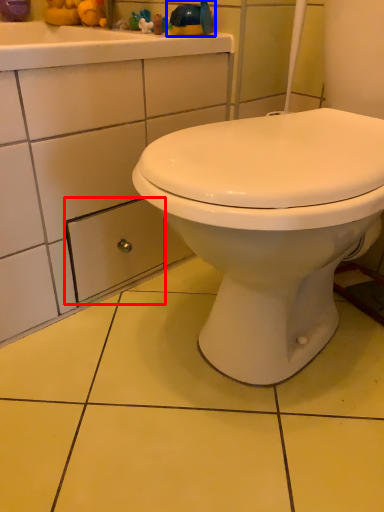
Question: Among these objects, which one is nearest to the camera, drawer (highlighted by a red box) or toy (highlighted by a blue box)?

Choices:
 (A) drawer
 (B) toy

Answer: (A)